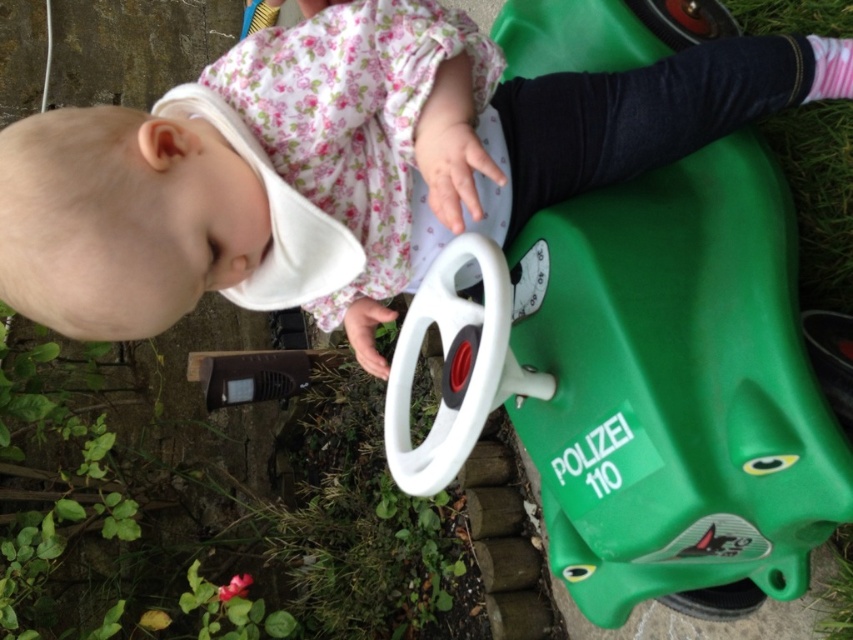
Between green plastic toy car at lower right and matte white bib at center, which one is positioned lower?

green plastic toy car at lower right is lower down.

Does green plastic toy car at lower right appear on the right side of matte white bib at center?

Correct, you'll find green plastic toy car at lower right to the right of matte white bib at center.

Describe the element at coordinates (675, 385) in the screenshot. I see `green plastic toy car at lower right` at that location.

This screenshot has width=853, height=640. What are the coordinates of `green plastic toy car at lower right` in the screenshot? It's located at (675, 385).